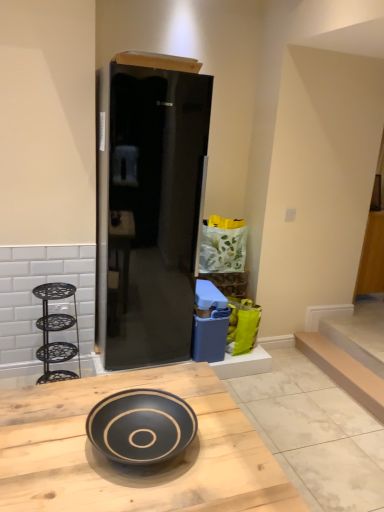
Question: Could you tell me if matte cardboard box at upper center is turned towards black glass refrigerator at center?

Choices:
 (A) no
 (B) yes

Answer: (A)

Question: Is there a large distance between matte cardboard box at upper center and black glass refrigerator at center?

Choices:
 (A) yes
 (B) no

Answer: (B)

Question: Is matte cardboard box at upper center looking in the opposite direction of black glass refrigerator at center?

Choices:
 (A) no
 (B) yes

Answer: (A)

Question: Is matte cardboard box at upper center not inside black glass refrigerator at center?

Choices:
 (A) no
 (B) yes

Answer: (B)

Question: From a real-world perspective, is matte cardboard box at upper center under black glass refrigerator at center?

Choices:
 (A) yes
 (B) no

Answer: (B)

Question: Is the surface of matte cardboard box at upper center in direct contact with black glass refrigerator at center?

Choices:
 (A) yes
 (B) no

Answer: (B)

Question: Does smooth beige stair at lower right come in front of matte cardboard box at upper center?

Choices:
 (A) yes
 (B) no

Answer: (B)

Question: Is smooth beige stair at lower right placed right next to matte cardboard box at upper center?

Choices:
 (A) no
 (B) yes

Answer: (A)

Question: Can you confirm if smooth beige stair at lower right is wider than matte cardboard box at upper center?

Choices:
 (A) yes
 (B) no

Answer: (B)

Question: Is smooth beige stair at lower right thinner than matte cardboard box at upper center?

Choices:
 (A) no
 (B) yes

Answer: (B)

Question: Is smooth beige stair at lower right facing away from matte cardboard box at upper center?

Choices:
 (A) no
 (B) yes

Answer: (A)

Question: Is smooth beige stair at lower right behind matte cardboard box at upper center?

Choices:
 (A) yes
 (B) no

Answer: (A)

Question: Considering the relative sizes of black glass refrigerator at center and black matte bowl at center in the image provided, is black glass refrigerator at center shorter than black matte bowl at center?

Choices:
 (A) no
 (B) yes

Answer: (A)